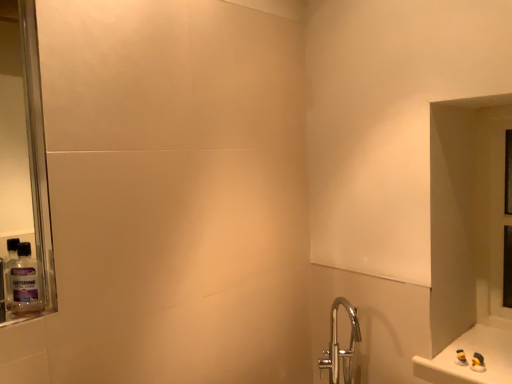
Locate an element on the screen. This screenshot has height=384, width=512. clear plastic mouthwash at left is located at coordinates (23, 281).

Looking at this image, in order to face clear plastic mouthwash at left, should I rotate leftwards or rightwards?

It's best to rotate left around 28.714 degrees.

Where is `transparent glass door at right`? This screenshot has height=384, width=512. transparent glass door at right is located at coordinates (497, 211).

Find the location of `white glossy counter at lower right`. white glossy counter at lower right is located at coordinates (470, 358).

Locate an element on the screen. The image size is (512, 384). mouthwash located on the left of transparent glass door at right is located at coordinates (23, 281).

Can you confirm if clear plastic mouthwash at left is bigger than transparent glass door at right?

Incorrect, clear plastic mouthwash at left is not larger than transparent glass door at right.

Is clear plastic mouthwash at left not near transparent glass door at right?

Yes, clear plastic mouthwash at left and transparent glass door at right are located far from each other.

Is point (35, 304) less distant than point (499, 138)?

Yes, it is.

Is transparent glass door at right oriented away from clear plastic mouthwash at left?

transparent glass door at right is not turned away from clear plastic mouthwash at left.

The width and height of the screenshot is (512, 384). Find the location of `glass door located underneath the clear plastic mouthwash at left (from a real-world perspective)`. glass door located underneath the clear plastic mouthwash at left (from a real-world perspective) is located at coordinates (497, 211).

Considering the relative sizes of transparent glass door at right and clear plastic mouthwash at left in the image provided, is transparent glass door at right bigger than clear plastic mouthwash at left?

Yes, transparent glass door at right is bigger than clear plastic mouthwash at left.

How much distance is there between transparent glass door at right and clear plastic mouthwash at left?

A distance of 6.51 feet exists between transparent glass door at right and clear plastic mouthwash at left.

Which is behind, point (436, 369) or point (40, 273)?

Positioned behind is point (436, 369).

Is clear plastic mouthwash at left a part of white glossy counter at lower right?

No, clear plastic mouthwash at left is not a part of white glossy counter at lower right.

Between white glossy counter at lower right and clear plastic mouthwash at left, which one appears on the left side from the viewer's perspective?

Positioned to the left is clear plastic mouthwash at left.

Is white glossy counter at lower right directly adjacent to clear plastic mouthwash at left?

No, white glossy counter at lower right is not making contact with clear plastic mouthwash at left.

Which is nearer, (502, 260) or (419, 373)?

The point (419, 373) is closer.

Does transparent glass door at right come in front of white glossy counter at lower right?

No, the depth of transparent glass door at right is greater than that of white glossy counter at lower right.

Can you tell me how much transparent glass door at right and white glossy counter at lower right differ in facing direction?

Result: transparent glass door at right and white glossy counter at lower right are facing 0.314 degrees away from each other.

From the image's perspective, who appears lower, transparent glass door at right or white glossy counter at lower right?

white glossy counter at lower right.

In the scene shown: Which object is thinner, white glossy counter at lower right or transparent glass door at right?

With smaller width is transparent glass door at right.

Can you tell me how much white glossy counter at lower right and transparent glass door at right differ in facing direction?

The angular difference between white glossy counter at lower right and transparent glass door at right is 0.314 degrees.

Is white glossy counter at lower right bigger or smaller than transparent glass door at right?

Clearly, white glossy counter at lower right is smaller in size than transparent glass door at right.

Looking at this image, which is in front, white glossy counter at lower right or transparent glass door at right?

Positioned in front is white glossy counter at lower right.

From a real-world perspective, between clear plastic mouthwash at left and white glossy counter at lower right, who is vertically higher?

In real-world perspective, clear plastic mouthwash at left is above.

Which is nearer, (24, 261) or (446, 364)?

The point (24, 261) is closer to the camera.

Can you confirm if clear plastic mouthwash at left is shorter than white glossy counter at lower right?

Incorrect, the height of clear plastic mouthwash at left does not fall short of that of white glossy counter at lower right.

Can you confirm if clear plastic mouthwash at left is wider than white glossy counter at lower right?

No.

At what (x,y) coordinates should I click in order to perform the action: click on glass door located underneath the clear plastic mouthwash at left (from a real-world perspective). Please return your answer as a coordinate pair (x, y). This screenshot has height=384, width=512. Looking at the image, I should click on (497, 211).

At what (x,y) coordinates should I click in order to perform the action: click on mouthwash to the left of transparent glass door at right. Please return your answer as a coordinate pair (x, y). Looking at the image, I should click on (23, 281).

Looking at the image, which one is located closer to transparent glass door at right, clear plastic mouthwash at left or white glossy counter at lower right?

white glossy counter at lower right lies closer to transparent glass door at right than the other object.

Considering their positions, is white glossy counter at lower right positioned closer to transparent glass door at right than clear plastic mouthwash at left?

white glossy counter at lower right is positioned closer to the anchor transparent glass door at right.

Which object lies further to the anchor point clear plastic mouthwash at left, transparent glass door at right or white glossy counter at lower right?

Based on the image, transparent glass door at right appears to be further to clear plastic mouthwash at left.

Considering their positions, is transparent glass door at right positioned closer to white glossy counter at lower right than clear plastic mouthwash at left?

Based on the image, transparent glass door at right appears to be nearer to white glossy counter at lower right.

Estimate the real-world distances between objects in this image. Which object is closer to clear plastic mouthwash at left, white glossy counter at lower right or transparent glass door at right?

white glossy counter at lower right is closer to clear plastic mouthwash at left.

From the image, which object appears to be nearer to white glossy counter at lower right, clear plastic mouthwash at left or transparent glass door at right?

The object closer to white glossy counter at lower right is transparent glass door at right.

Locate an element on the screen. The height and width of the screenshot is (384, 512). counter between clear plastic mouthwash at left and transparent glass door at right in the horizontal direction is located at coordinates (470, 358).